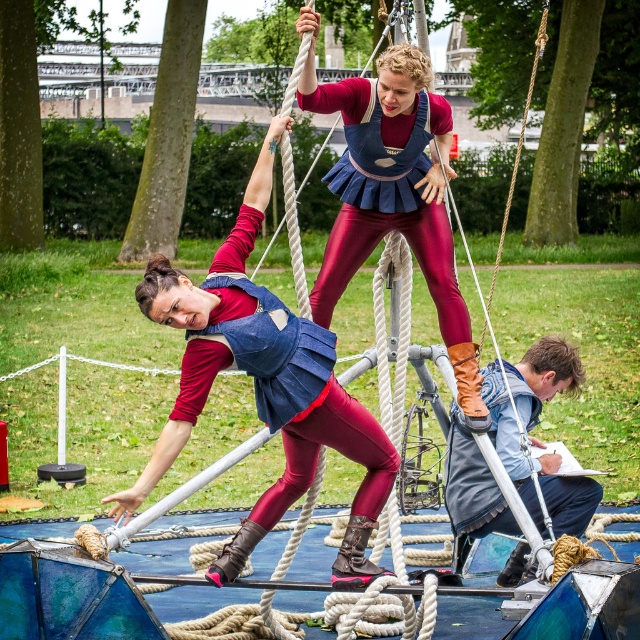
Based on the photo, you are a photographer positioned at the camera location. You want to capture a closeup shot of the shiny maroon leggings at center. Given that your telephoto lens can focus on objects up to 30 meters away, will you be able to take the photo?

The shiny maroon leggings at center is 28.93 meters away from camera, so yes, the telephoto lens can focus on objects up to 30 meters away, so you can take the photo.

In the scene shown: You are an observer standing in front of the performance area. Where is the denim vest at center located in terms of its position relative to the central point of the performance area?

The denim vest at center is located at the central point of the performance area.

You are a costume designer analyzing the performers in the image. Which of the following items takes up more area in the scene? The shiny maroon leggings at center or the denim vest at center?

The denim vest at center occupies more space than the shiny maroon leggings at center, so the denim vest at center takes up more area in the scene.